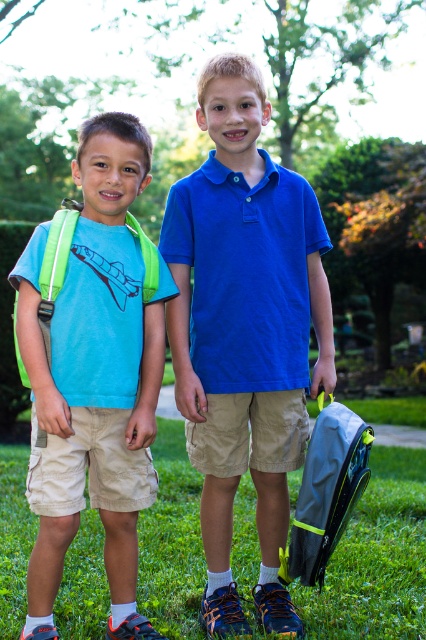
Based on the photo, between matte green backpack at left and green grass at lower center, which one appears on the left side from the viewer's perspective?

matte green backpack at left

Is matte green backpack at left closer to the viewer compared to green grass at lower center?

Yes, it is.

Between point (129, 596) and point (397, 499), which one is positioned in front?

Point (129, 596)

The image size is (426, 640). In order to click on matte green backpack at left in this screenshot , I will do `click(94, 376)`.

Can you confirm if blue cotton polo shirt at center is positioned to the left of green grass at lower center?

Yes, blue cotton polo shirt at center is to the left of green grass at lower center.

Is blue cotton polo shirt at center wider than green grass at lower center?

Yes.

Where is `blue cotton polo shirt at center`? This screenshot has width=426, height=640. blue cotton polo shirt at center is located at coordinates (244, 332).

Which is behind, point (192, 442) or point (77, 461)?

The point (192, 442) is more distant.

Is point (322, 380) positioned after point (132, 122)?

Yes, it is.

Identify the location of blue cotton polo shirt at center. (244, 332).